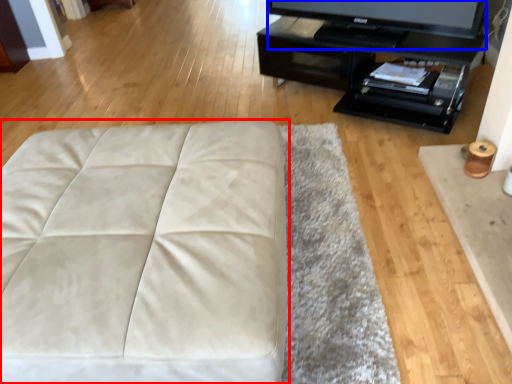
Question: Which point is closer to the camera, furniture (highlighted by a red box) or television (highlighted by a blue box)?

Choices:
 (A) furniture
 (B) television

Answer: (A)